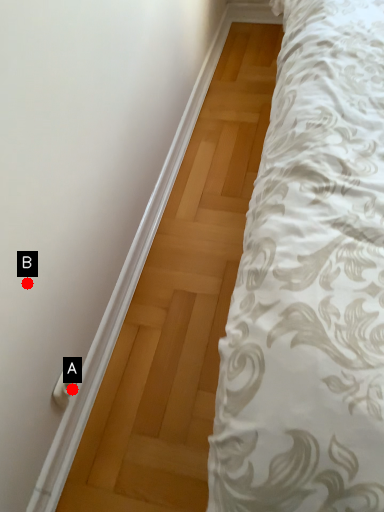
Question: Two points are circled on the image, labeled by A and B beside each circle. Which point is closer to the camera?

Choices:
 (A) A is closer
 (B) B is closer

Answer: (B)